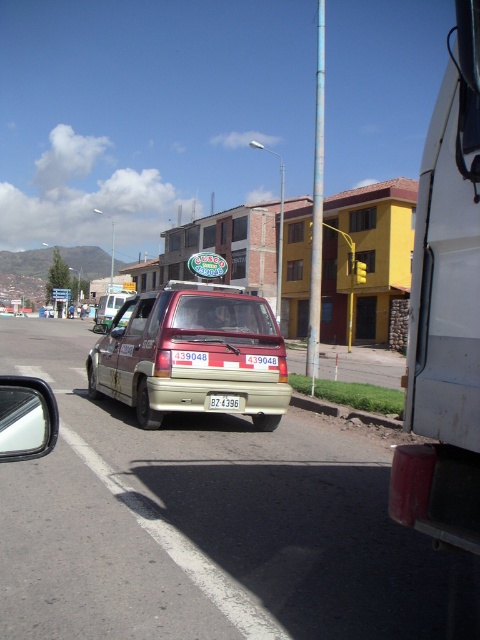
Question: Does white matte van at right have a lesser width compared to beige matte van at center?

Choices:
 (A) no
 (B) yes

Answer: (B)

Question: Which object appears farthest from the camera in this image?

Choices:
 (A) white plastic license plate at center
 (B) white matte van at right
 (C) gold metallic van at center

Answer: (A)

Question: Which of the following is the closest to the observer?

Choices:
 (A) (108, 314)
 (B) (284, 353)

Answer: (B)

Question: Can you confirm if gold metallic van at center is smaller than beige matte van at center?

Choices:
 (A) no
 (B) yes

Answer: (B)

Question: In this image, where is beige matte van at center located relative to white plastic license plate at center?

Choices:
 (A) below
 (B) above

Answer: (B)

Question: Based on their relative distances, which object is farther from the beige matte van at center?

Choices:
 (A) white matte van at right
 (B) white plastic license plate at center
 (C) gold metallic van at center

Answer: (A)